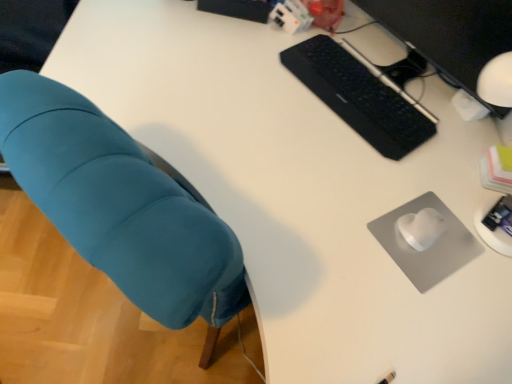
Locate an element on the screen. free space in front of black matte keyboard at upper right is located at coordinates (330, 172).